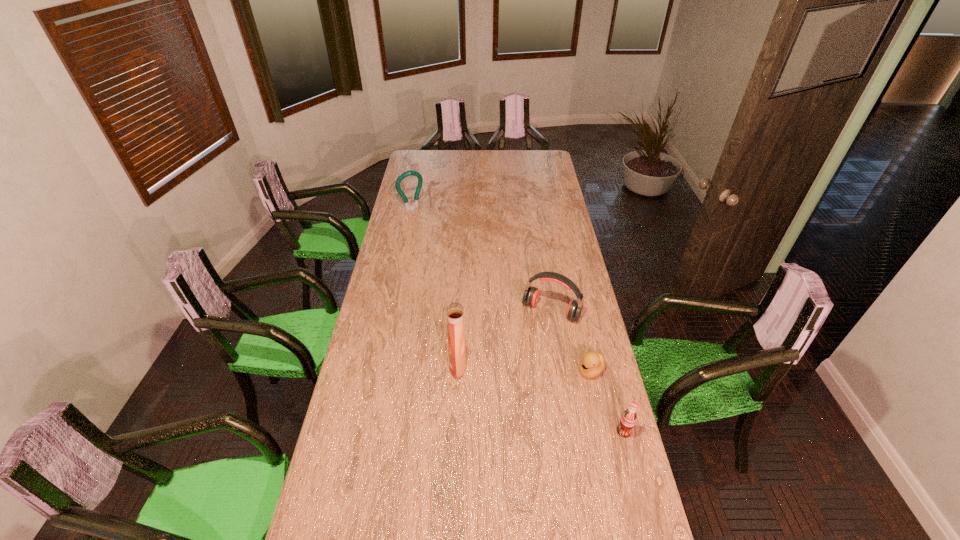
Identify the location of vacant space that satisfies the following two spatial constraints: 1. on the front side of the leftmost object; 2. on the front-facing side of the tallest object. (380, 364).

At what (x,y) coordinates should I click in order to perform the action: click on vacant space that satisfies the following two spatial constraints: 1. on the front side of the fourth nearest object; 2. on the left side of the bottle opener. Please return your answer as a coordinate pair (x, y). This screenshot has height=540, width=960. Looking at the image, I should click on (391, 311).